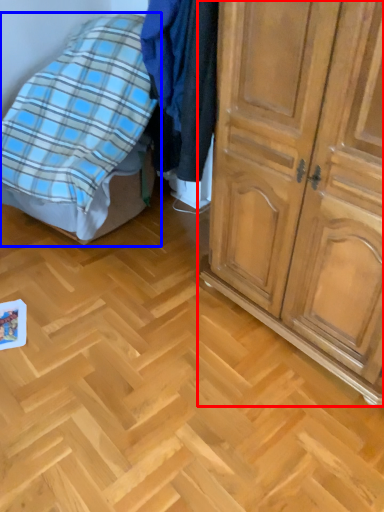
Question: Among these objects, which one is farthest to the camera, cupboard (highlighted by a red box) or bed (highlighted by a blue box)?

Choices:
 (A) cupboard
 (B) bed

Answer: (B)